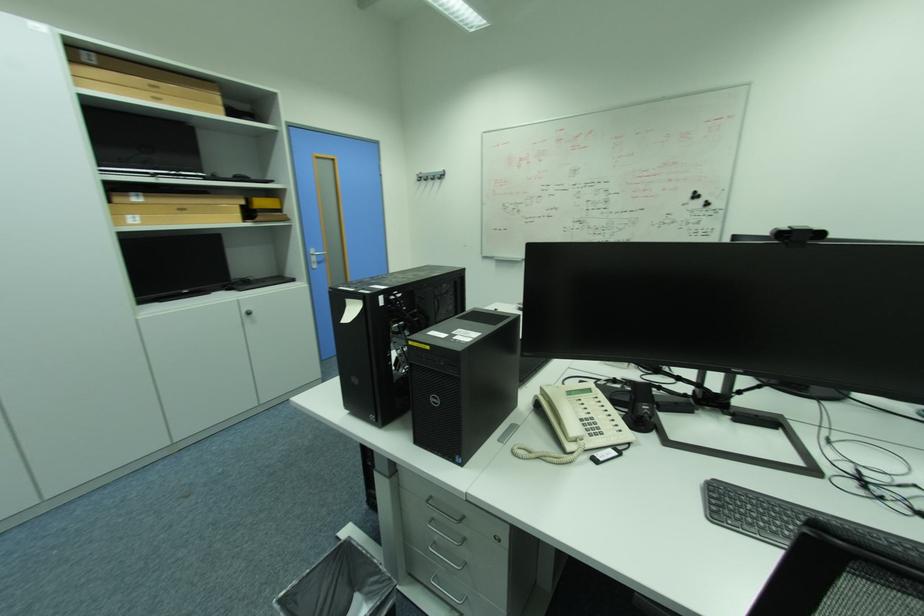
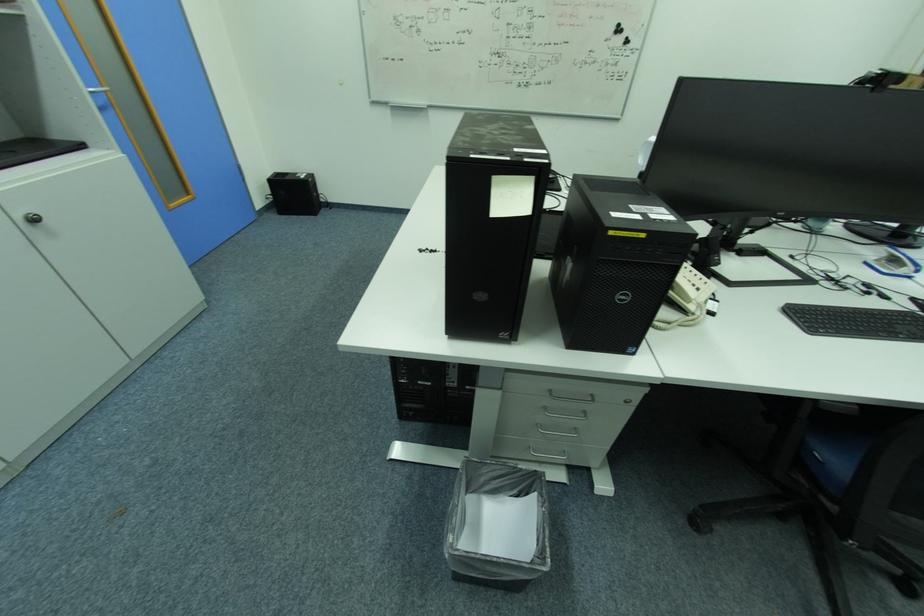
First-person continuous shooting, in which direction is the camera rotating?

The camera's rotation is toward right-down.